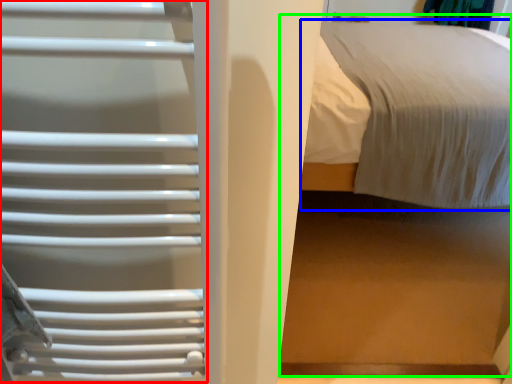
Question: Considering the real-world distances, which object is farthest from cage (highlighted by a red box)? bed (highlighted by a blue box) or bed (highlighted by a green box)?

Choices:
 (A) bed
 (B) bed

Answer: (A)